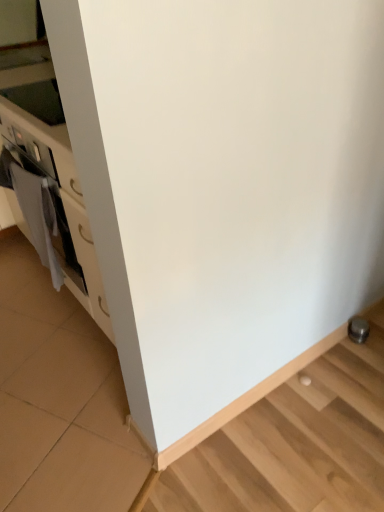
I want to click on metallic silver stairwell at lower right, so click(295, 443).

Based on the photo, in order to face metallic silver stairwell at lower right, should I rotate leftwards or rightwards?

To align with it, rotate right about 13.637°.

What do you see at coordinates (295, 443) in the screenshot?
I see `metallic silver stairwell at lower right` at bounding box center [295, 443].

Describe the element at coordinates (38, 217) in the screenshot. I see `white fabric at left` at that location.

This screenshot has width=384, height=512. Identify the location of white fabric at left. (38, 217).

At what (x,y) coordinates should I click in order to perform the action: click on metallic silver stairwell at lower right. Please return your answer as a coordinate pair (x, y). Looking at the image, I should click on (295, 443).

Considering the relative positions of metallic silver stairwell at lower right and white fabric at left in the image provided, is metallic silver stairwell at lower right to the right of white fabric at left from the viewer's perspective?

Yes.

Which is behind, metallic silver stairwell at lower right or white fabric at left?

white fabric at left is more distant.

Is point (304, 506) in front of point (20, 193)?

Yes, it is.

From the image's perspective, is metallic silver stairwell at lower right on white fabric at left?

No, from the image's perspective, metallic silver stairwell at lower right is not over white fabric at left.

From a real-world perspective, is metallic silver stairwell at lower right physically located above or below white fabric at left?

Clearly, from a real-world perspective, metallic silver stairwell at lower right is below white fabric at left.

Which object is wider, metallic silver stairwell at lower right or white fabric at left?

white fabric at left.

Considering the relative sizes of metallic silver stairwell at lower right and white fabric at left in the image provided, is metallic silver stairwell at lower right shorter than white fabric at left?

Yes.

Which of these two, metallic silver stairwell at lower right or white fabric at left, is bigger?

white fabric at left is bigger.

Is metallic silver stairwell at lower right located outside white fabric at left?

metallic silver stairwell at lower right lies outside white fabric at left's area.

Are metallic silver stairwell at lower right and white fabric at left making contact?

metallic silver stairwell at lower right and white fabric at left are not in contact.

Is metallic silver stairwell at lower right oriented away from white fabric at left?

metallic silver stairwell at lower right is not turned away from white fabric at left.

Looking at this image, how far apart are metallic silver stairwell at lower right and white fabric at left?

A distance of 3.31 feet exists between metallic silver stairwell at lower right and white fabric at left.

Identify the location of material on the left of metallic silver stairwell at lower right. The image size is (384, 512). (38, 217).

Is white fabric at left at the left side of metallic silver stairwell at lower right?

Indeed, white fabric at left is positioned on the left side of metallic silver stairwell at lower right.

From the picture: Is white fabric at left closer to camera compared to metallic silver stairwell at lower right?

No, white fabric at left is behind metallic silver stairwell at lower right.

Between point (14, 185) and point (312, 496), which one is positioned in front?

The point (312, 496) is more forward.

From the image's perspective, is white fabric at left below metallic silver stairwell at lower right?

Actually, white fabric at left appears above metallic silver stairwell at lower right in the image.

From a real-world perspective, between white fabric at left and metallic silver stairwell at lower right, who is vertically lower?

From a 3D spatial view, metallic silver stairwell at lower right is below.

In terms of width, does white fabric at left look wider or thinner when compared to metallic silver stairwell at lower right?

Clearly, white fabric at left has more width compared to metallic silver stairwell at lower right.

Considering the relative sizes of white fabric at left and metallic silver stairwell at lower right in the image provided, is white fabric at left shorter than metallic silver stairwell at lower right?

Incorrect, the height of white fabric at left does not fall short of that of metallic silver stairwell at lower right.

Consider the image. Does white fabric at left have a smaller size compared to metallic silver stairwell at lower right?

Incorrect, white fabric at left is not smaller in size than metallic silver stairwell at lower right.

Does white fabric at left contain metallic silver stairwell at lower right?

No, metallic silver stairwell at lower right is not inside white fabric at left.

Is white fabric at left beside metallic silver stairwell at lower right?

white fabric at left and metallic silver stairwell at lower right are clearly separated.

Is metallic silver stairwell at lower right at the back of white fabric at left?

No.

How different are the orientations of white fabric at left and metallic silver stairwell at lower right in degrees?

91.2 degrees separate the facing orientations of white fabric at left and metallic silver stairwell at lower right.

How much distance is there between white fabric at left and metallic silver stairwell at lower right?

The distance of white fabric at left from metallic silver stairwell at lower right is 3.31 feet.

This screenshot has height=512, width=384. In order to click on material to the left of metallic silver stairwell at lower right in this screenshot , I will do `click(38, 217)`.

In the image, there is a white fabric at left. Where is `stairwell below it (from the image's perspective)`? The height and width of the screenshot is (512, 384). stairwell below it (from the image's perspective) is located at coordinates pos(295,443).

Locate an element on the screen. The image size is (384, 512). material above the metallic silver stairwell at lower right (from the image's perspective) is located at coordinates 38,217.